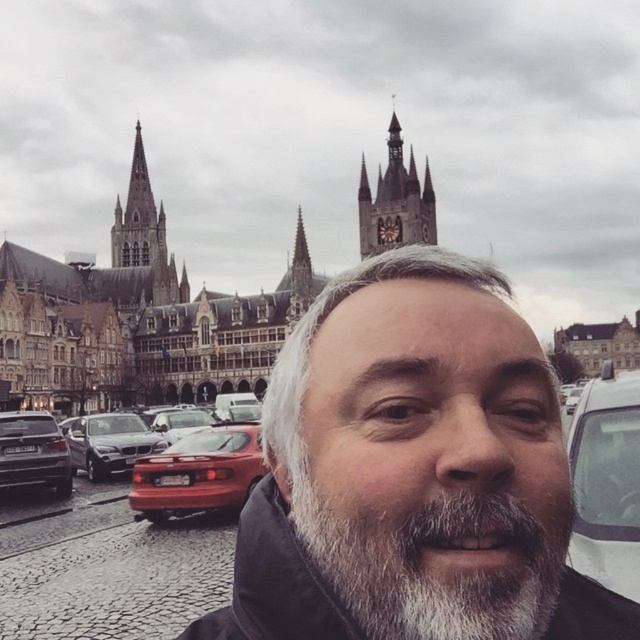
You are a photographer planning to take a photo of the historic cityscape. You want to include both the shiny silver sedan at left and the satin silver car at center in your shot. Which car should you focus on to ensure it appears larger in the final image?

The satin silver car at center should be focused on to ensure it appears larger in the final image because it is larger than the shiny silver sedan at left.

You are a photographer planning to take a wide shot of the golden stone clock tower at upper center and the satin silver car at center in the historic European cityscape. Your camera has a maximum focus range of 60 meters. Will both objects be in focus if you set the focus to the midpoint between them?

The golden stone clock tower at upper center and the satin silver car at center are 59.51 meters apart. The midpoint between them is at 29.755 meters from each object. Since the camera can focus up to 60 meters, both objects will be within the focus range and thus in focus.

You are a photographer trying to capture a wide shot of the historic cityscape. You notice the gray hair at center and the golden stone clock tower at upper center in your frame. Which object occupies more horizontal space in the photo?

The gray hair at center occupies more horizontal space than the golden stone clock tower at upper center because its width surpasses the clock tower.